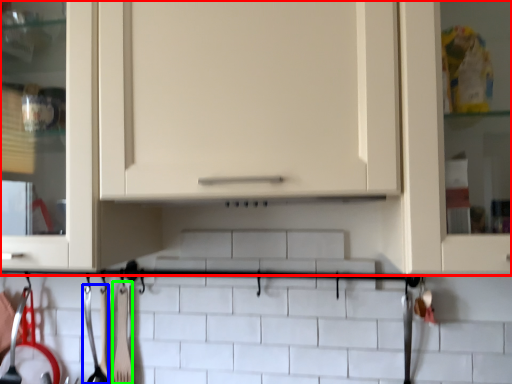
Question: Based on their relative distances, which object is farther from cabinetry (highlighted by a red box)? Choose from silverware (highlighted by a blue box) and silverware (highlighted by a green box).

Choices:
 (A) silverware
 (B) silverware

Answer: (A)